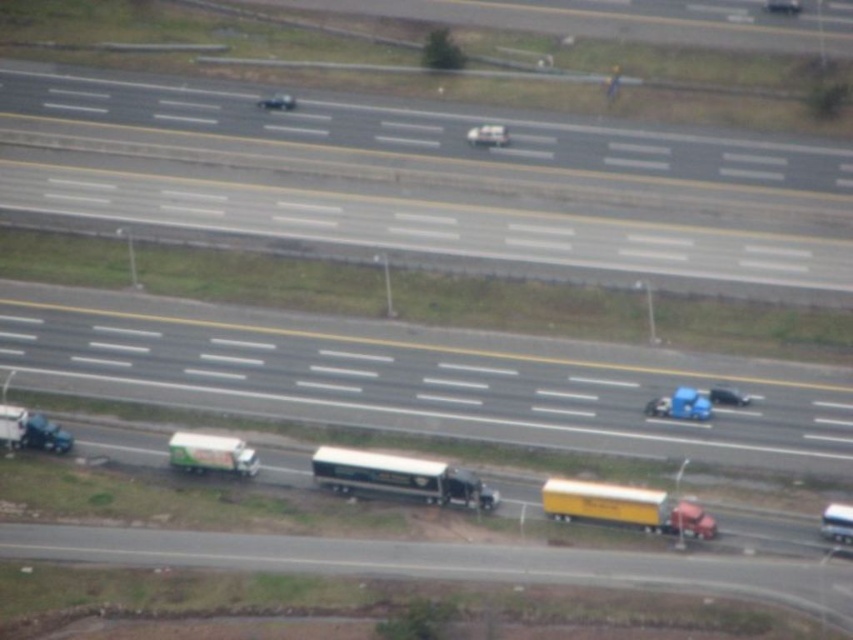
Does yellow matte truck at lower right appear on the left side of shiny silver sedan at center?

Incorrect, yellow matte truck at lower right is not on the left side of shiny silver sedan at center.

Does yellow matte truck at lower right have a smaller size compared to shiny silver sedan at center?

Correct, yellow matte truck at lower right occupies less space than shiny silver sedan at center.

Where is `yellow matte truck at lower right`? yellow matte truck at lower right is located at coordinates (624, 506).

Can you confirm if black glossy semi-truck at center is positioned below shiny black car at center?

Indeed, black glossy semi-truck at center is positioned under shiny black car at center.

Does black glossy semi-truck at center appear on the left side of shiny black car at center?

In fact, black glossy semi-truck at center is to the right of shiny black car at center.

Image resolution: width=853 pixels, height=640 pixels. Identify the location of black glossy semi-truck at center. (399, 476).

Based on the photo, is the position of smooth asphalt highway at upper center more distant than that of green matte truck at center?

Yes, smooth asphalt highway at upper center is behind green matte truck at center.

Consider the image. Does smooth asphalt highway at upper center appear over green matte truck at center?

Yes.

Which is in front, point (387, 132) or point (213, 442)?

Point (213, 442)

In order to click on smooth asphalt highway at upper center in this screenshot , I will do `click(431, 131)`.